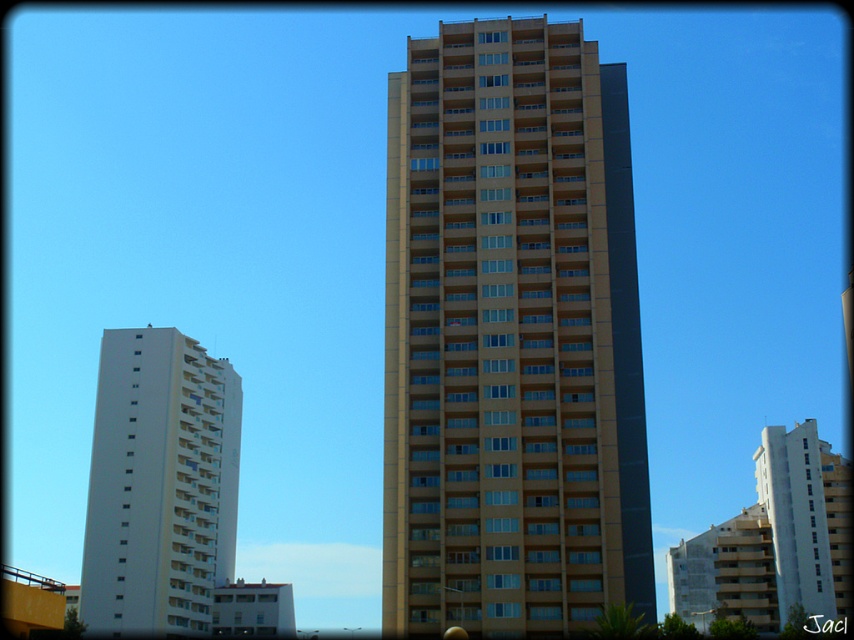
Question: Which point is closer to the camera?

Choices:
 (A) white smooth building at center
 (B) beige concrete building at center
 (C) white smooth building at left

Answer: (B)

Question: Which is nearer to the beige concrete building at center?

Choices:
 (A) white smooth building at left
 (B) white smooth building at center

Answer: (A)

Question: Can you confirm if beige concrete building at center is positioned to the right of white smooth building at center?

Choices:
 (A) no
 (B) yes

Answer: (A)

Question: Which point appears farthest from the camera in this image?

Choices:
 (A) (588, 513)
 (B) (805, 582)

Answer: (B)

Question: Is beige concrete building at center wider than white smooth building at center?

Choices:
 (A) yes
 (B) no

Answer: (A)

Question: Does beige concrete building at center lie behind white smooth building at left?

Choices:
 (A) yes
 (B) no

Answer: (B)